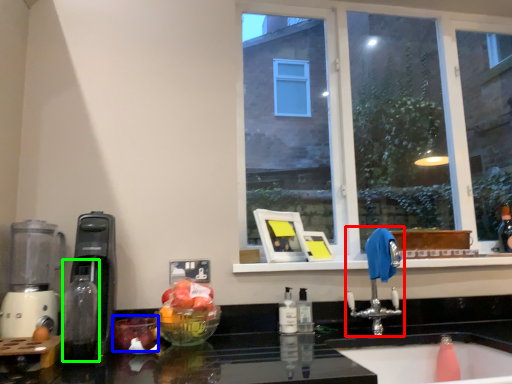
Question: Estimate the real-world distances between objects in this image. Which object is closer to tap (highlighted by a red box), apple (highlighted by a blue box) or bottle (highlighted by a green box)?

Choices:
 (A) apple
 (B) bottle

Answer: (A)